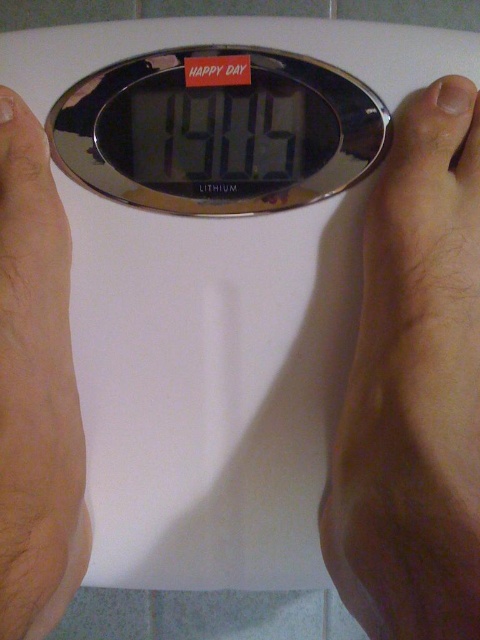
Please describe the location of the dry skin at right in the image using coordinates. The coordinate system has the origin at the bottom left corner of the image, with the x and y axes increasing to the right and up respectively. The coordinates are normalized between 0 and 1.

The dry skin at right is located at coordinates point (415, 387).

You are a dermatologist examining a patient. You notice two areas on their feet visible in the image. The dry skin at right and the skinny flesh at left. Which area is more likely to be visible to you from your current position?

The dry skin at right is closer to the viewer than the skinny flesh at left, so the dry skin at right would be more visible from your current position.

You are a dermatologist examining a patient. You notice two areas on their feet visible in the image. The dry skin at right and the skinny flesh at left. Which area is higher up on the foot?

The dry skin at right is taller than the skinny flesh at left, so the dry skin at right is higher up on the foot.